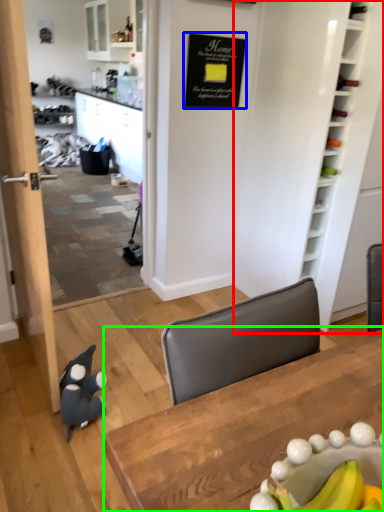
Question: Considering the real-world distances, which object is closest to bookshelf (highlighted by a red box)? bulletin board (highlighted by a blue box) or table (highlighted by a green box).

Choices:
 (A) bulletin board
 (B) table

Answer: (A)